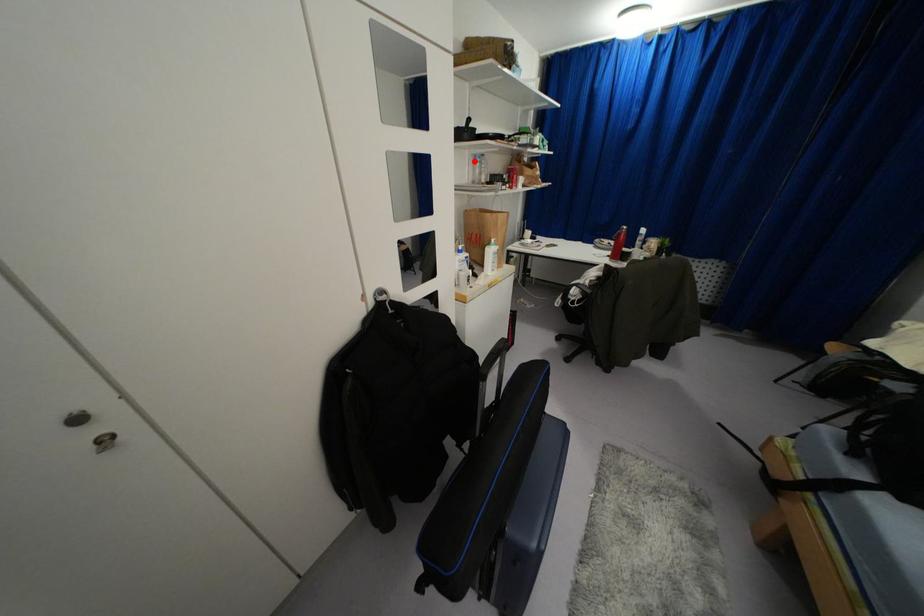
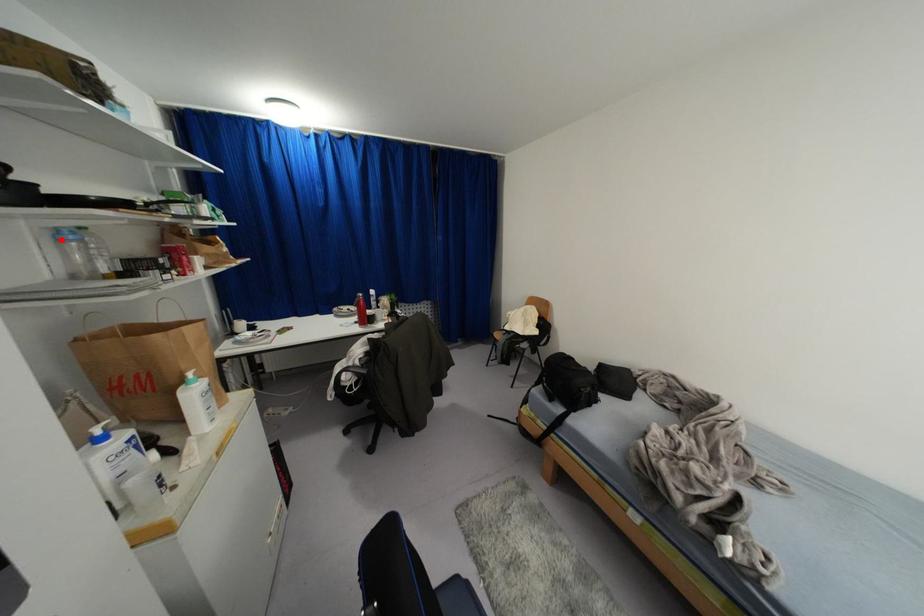
I am providing you with two images of the same scene from different viewpoints. A red point is marked on the first image and another point is marked on the second image. Is the marked point in image1 the same physical position as the marked point in image2?

Yes